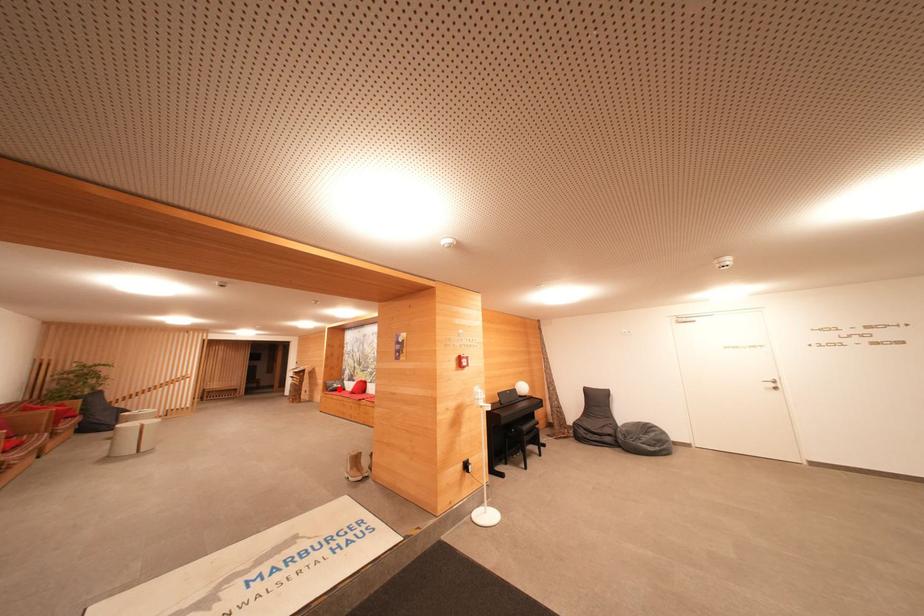
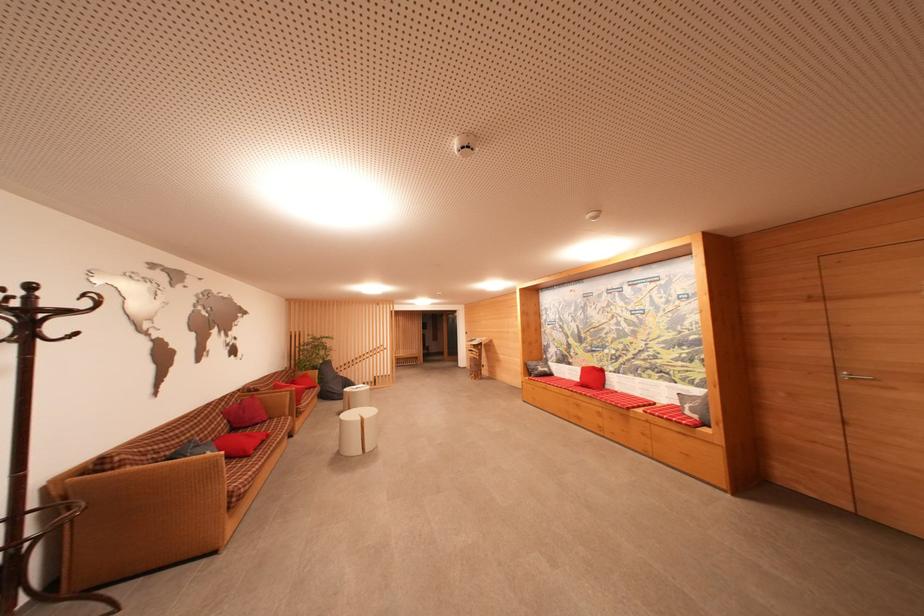
Where in the second image is the point corresponding to the highlighted location from the first image?

(544, 371)